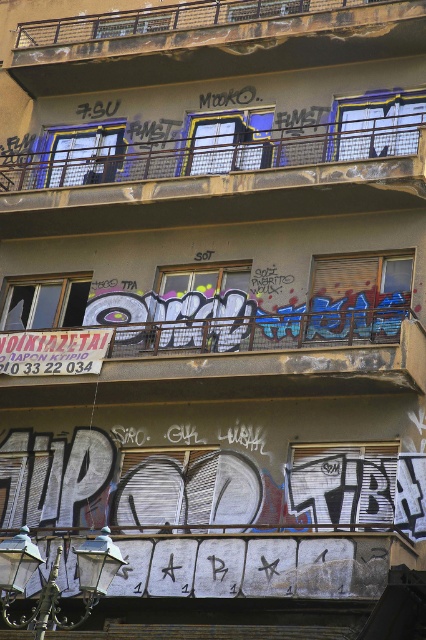
This screenshot has height=640, width=426. What do you see at coordinates (236, 365) in the screenshot? I see `metallic graffiti at center` at bounding box center [236, 365].

Does point (279, 380) come in front of point (244, 24)?

That is True.

Locate an element on the screen. metallic graffiti at center is located at coordinates (236, 365).

Looking at this image, which is above, metallic mesh balcony at upper center or brushed metal balcony at upper center?

brushed metal balcony at upper center

Which is below, metallic mesh balcony at upper center or brushed metal balcony at upper center?

metallic mesh balcony at upper center is lower down.

Is point (184, 154) positioned behind point (149, 35)?

No, it is not.

Image resolution: width=426 pixels, height=640 pixels. I want to click on metallic mesh balcony at upper center, so click(218, 163).

Can you confirm if metallic graffiti at center is positioned to the right of metallic mesh balcony at upper center?

Indeed, metallic graffiti at center is positioned on the right side of metallic mesh balcony at upper center.

Which is below, metallic graffiti at center or metallic mesh balcony at upper center?

metallic graffiti at center is lower down.

Which is behind, point (236, 369) or point (340, 144)?

The point (340, 144) is behind.

Identify the location of metallic graffiti at center. Image resolution: width=426 pixels, height=640 pixels. (236, 365).